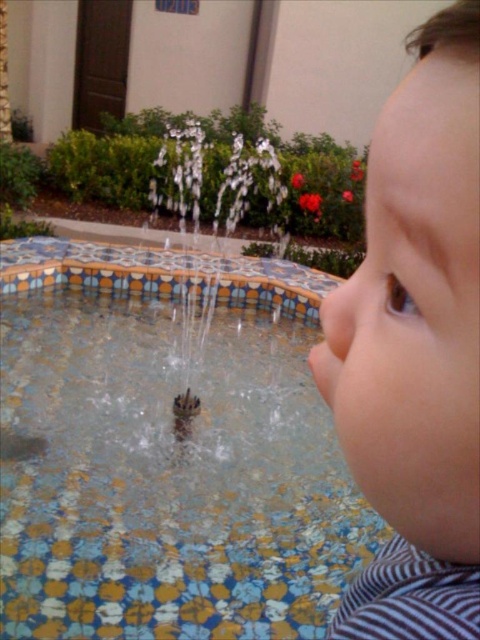
Is multicolored mosaic pool at center positioned in front of smooth skin toddler at right?

No, it is behind smooth skin toddler at right.

Which is behind, point (180, 612) or point (382, 392)?

The point (180, 612) is behind.

Is point (212, 573) positioned after point (442, 32)?

Yes.

Identify the location of multicolored mosaic pool at center. This screenshot has width=480, height=640. (167, 449).